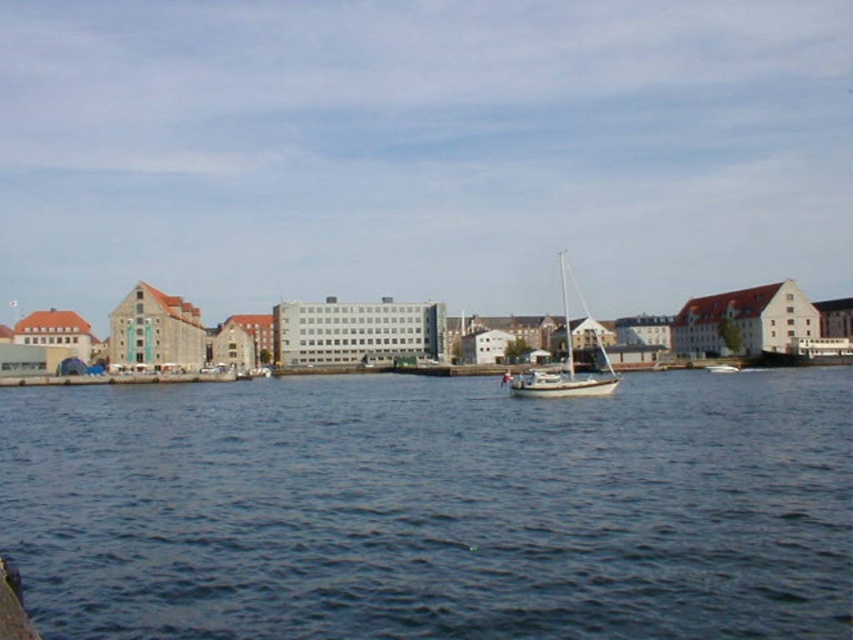
Does blue water at center appear on the right side of white matte sailboat at center?

Incorrect, blue water at center is not on the right side of white matte sailboat at center.

Between blue water at center and white matte sailboat at center, which one is positioned higher?

white matte sailboat at center is higher up.

Does point (711, 568) come closer to viewer compared to point (540, 387)?

Yes, point (711, 568) is closer to viewer.

Find the location of a particular element. blue water at center is located at coordinates (433, 508).